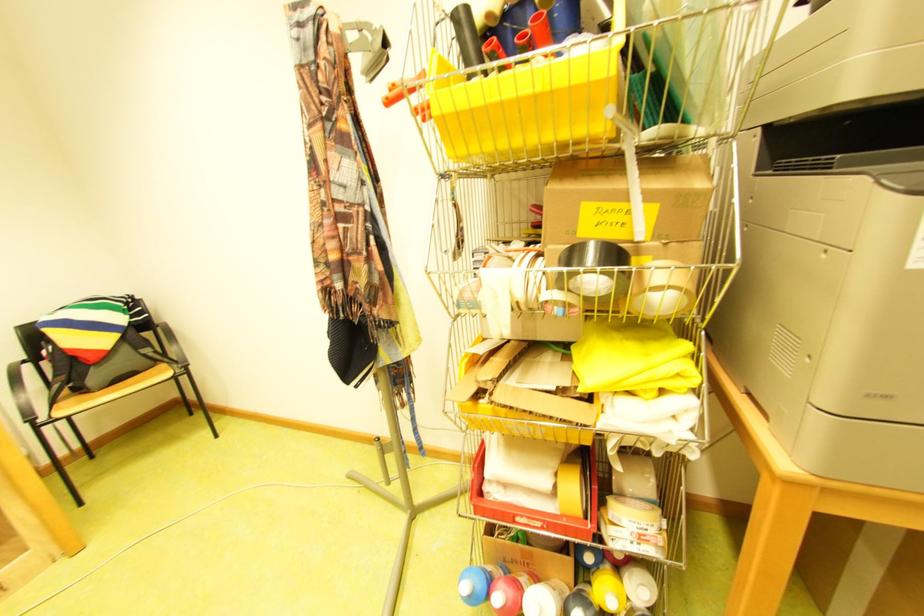
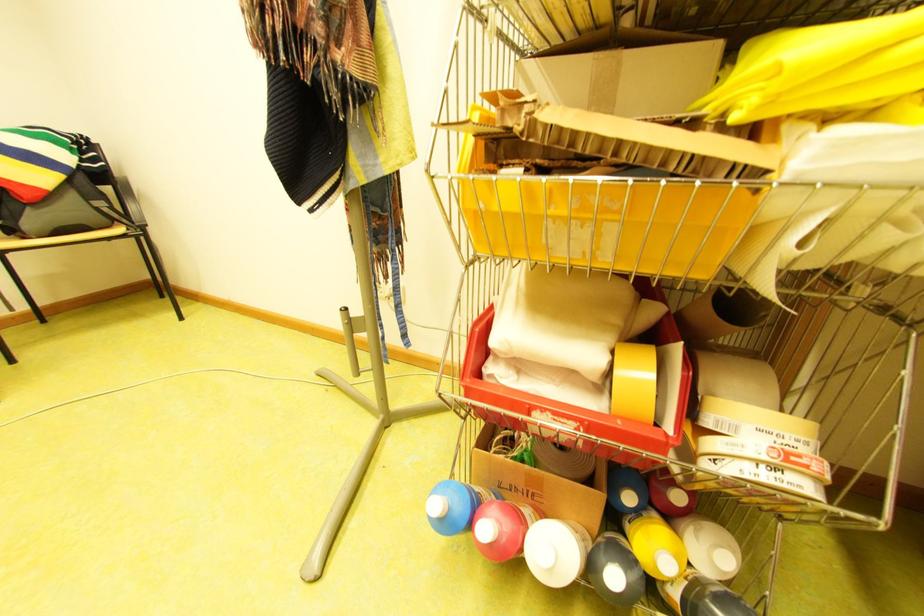
Question: I am providing you with two images of the same scene from different viewpoints. Please identify which objects are invisible in image2.

Choices:
 (A) red-capped bottle
 (B) roll of yellow tape
 (C) white-capped bottle
 (D) none of these

Answer: (D)